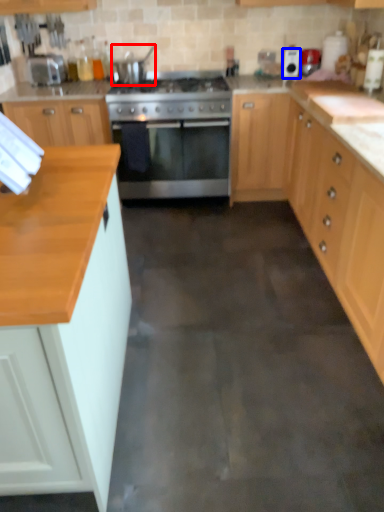
Question: Which object appears closest to the camera in this image, appliance (highlighted by a red box) or appliance (highlighted by a blue box)?

Choices:
 (A) appliance
 (B) appliance

Answer: (A)